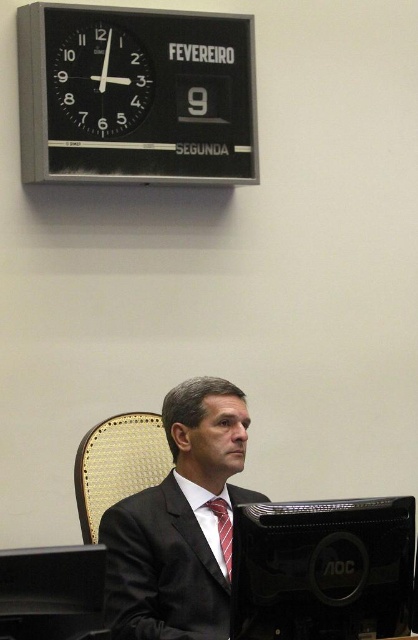
Question: Can you confirm if black plastic monitor at lower center is bigger than black plastic clock at upper left?

Choices:
 (A) no
 (B) yes

Answer: (A)

Question: From the image, what is the correct spatial relationship of black plastic monitor at lower center in relation to black plastic clock at upper left?

Choices:
 (A) right
 (B) left

Answer: (A)

Question: Which point is farther to the camera?

Choices:
 (A) (73, 51)
 (B) (226, 564)

Answer: (A)

Question: Which point is closer to the camera?

Choices:
 (A) red silk tie at center
 (B) woven fabric chair at center
 (C) black plastic clock at upper left
 (D) matte black suit at center

Answer: (D)

Question: Among these points, which one is farthest from the camera?

Choices:
 (A) (231, 147)
 (B) (112, 456)
 (C) (142, 596)
 (D) (222, 538)

Answer: (A)

Question: From the image, what is the correct spatial relationship of black plastic clock at upper center in relation to black plastic monitor at lower center?

Choices:
 (A) below
 (B) above

Answer: (B)